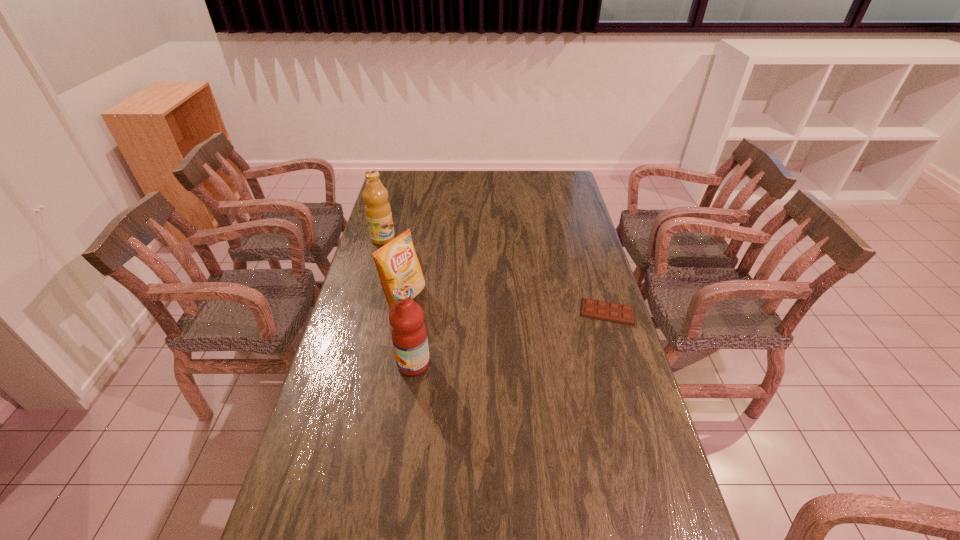
The width and height of the screenshot is (960, 540). Find the location of `object that is the closest to the rightmost object`. object that is the closest to the rightmost object is located at coordinates (408, 331).

Identify which object is the nearest to the crisp (potato chip). Please provide its 2D coordinates. Your answer should be formatted as a tuple, i.e. [(x, y)], where the tuple contains the x and y coordinates of a point satisfying the conditions above.

[(408, 331)]

Locate an element on the screen. vacant area that satisfies the following two spatial constraints: 1. on the front side of the olive oil; 2. on the left side of the crisp (potato chip) is located at coordinates (367, 298).